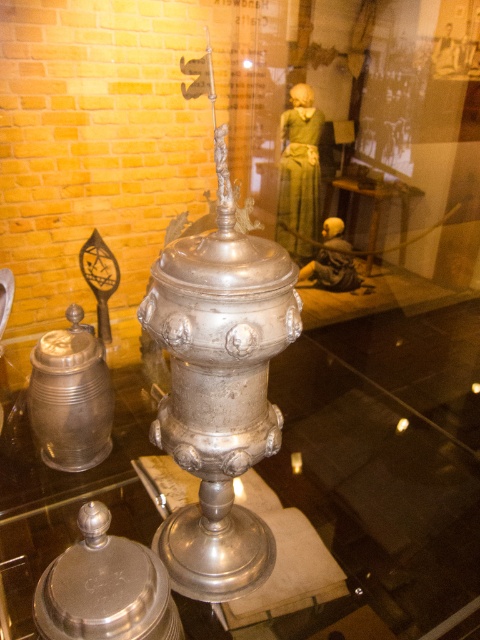
Question: Among these points, which one is nearest to the camera?

Choices:
 (A) (85, 634)
 (B) (27, 408)

Answer: (A)

Question: Is polished silver teapot at lower left to the left of polished silver tankard at left from the viewer's perspective?

Choices:
 (A) no
 (B) yes

Answer: (A)

Question: Is polished silver teapot at lower left positioned before polished silver tankard at left?

Choices:
 (A) no
 (B) yes

Answer: (B)

Question: In this image, where is polished silver teapot at lower left located relative to polished silver tankard at left?

Choices:
 (A) left
 (B) right

Answer: (B)